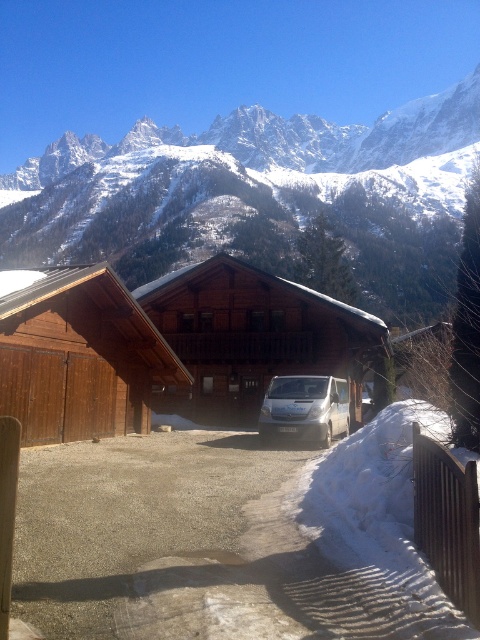
Question: Which object is positioned closest to the snowy rock at upper center?

Choices:
 (A) white metallic van at center
 (B) wooden cabin at center
 (C) brown wooden cabin at left

Answer: (C)

Question: Does wooden cabin at center have a larger size compared to white metallic van at center?

Choices:
 (A) no
 (B) yes

Answer: (B)

Question: Which object is positioned farthest from the white metallic van at center?

Choices:
 (A) wooden cabin at center
 (B) snowy rock at upper center

Answer: (B)

Question: Among these points, which one is nearest to the camera?

Choices:
 (A) (120, 416)
 (B) (291, 394)
 (C) (302, 184)
 (D) (242, 355)

Answer: (B)

Question: Does wooden cabin at center appear over white metallic van at center?

Choices:
 (A) no
 (B) yes

Answer: (B)

Question: Can you confirm if wooden cabin at center is smaller than brown wooden cabin at left?

Choices:
 (A) no
 (B) yes

Answer: (A)